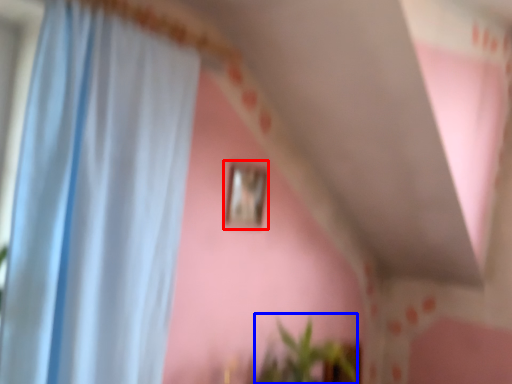
Question: Which object appears closest to the camera in this image, picture frame (highlighted by a red box) or plant (highlighted by a blue box)?

Choices:
 (A) picture frame
 (B) plant

Answer: (B)